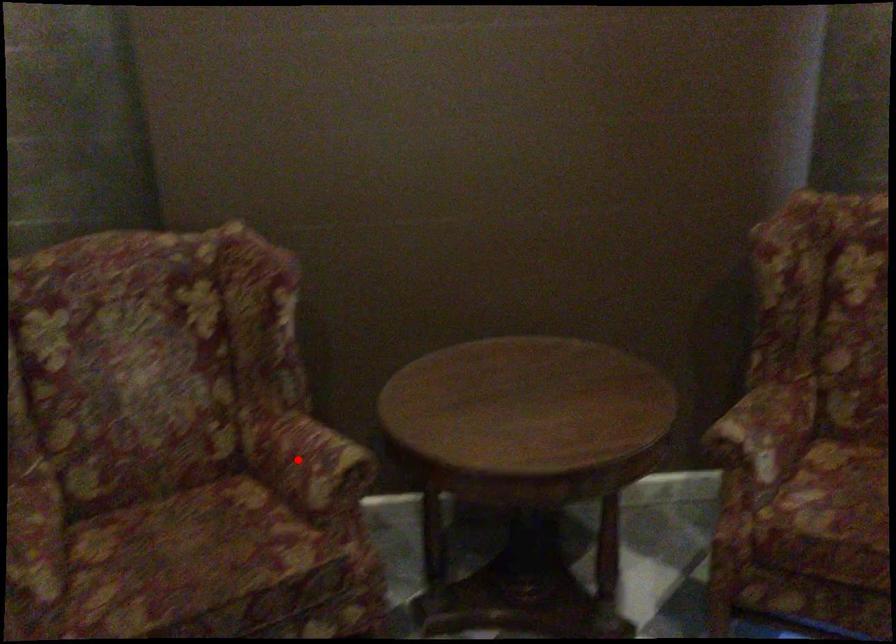
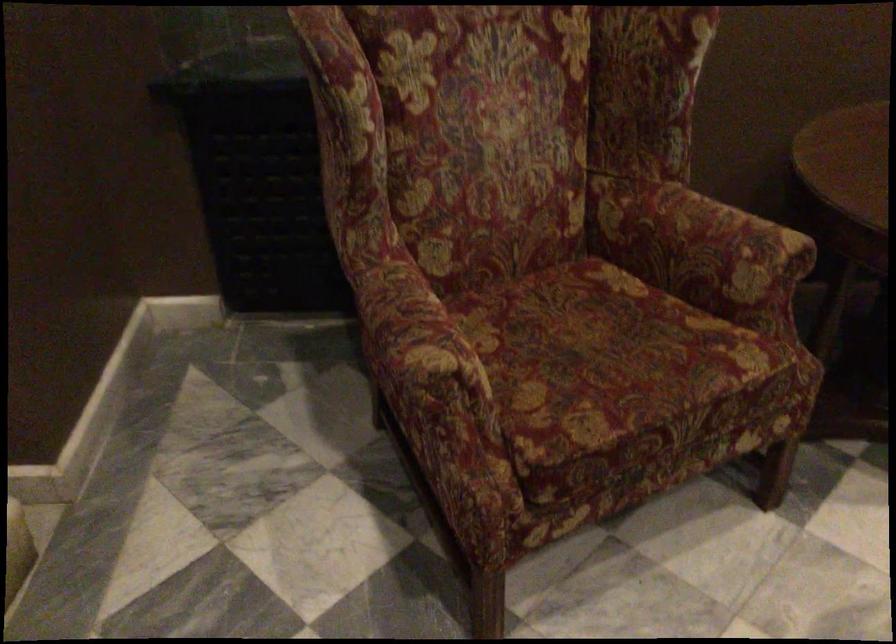
Question: I am providing you with two images of the same scene from different viewpoints. Given a red point in image1, look at the same physical point in image2. Is it:

Choices:
 (A) Closer to the viewpoint
 (B) Farther from the viewpoint

Answer: (A)